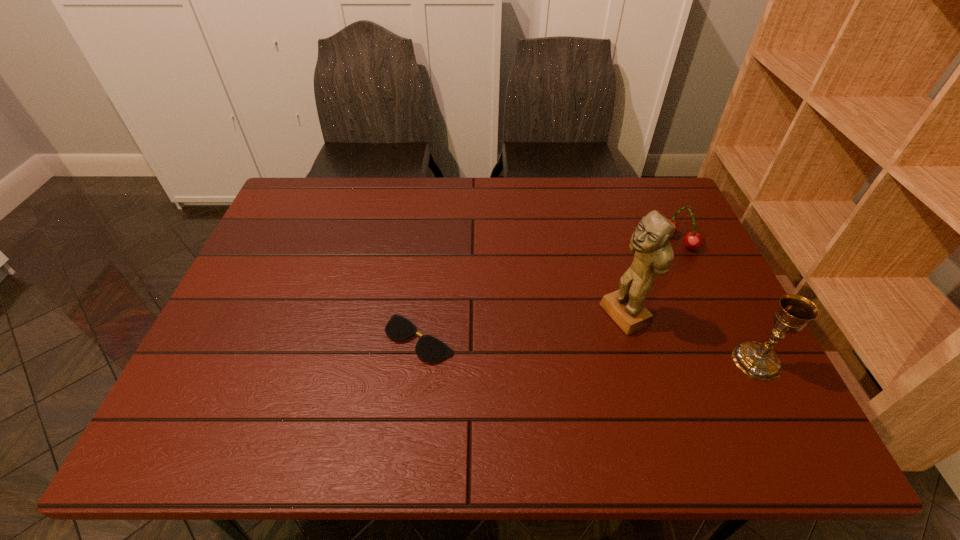
At what (x,y) coordinates should I click in order to perform the action: click on free region located 0.050m on the front-facing side of the figurine. Please return your answer as a coordinate pair (x, y). The image size is (960, 540). Looking at the image, I should click on (590, 333).

The width and height of the screenshot is (960, 540). What are the coordinates of `vacant space situated on the front-facing side of the figurine` in the screenshot? It's located at (459, 395).

Identify the location of vacant space located 0.060m with stems pointing upwards on the cherry. (656, 258).

Where is `vacant area located with stems pointing upwards on the cherry`? The width and height of the screenshot is (960, 540). vacant area located with stems pointing upwards on the cherry is located at coordinates (624, 281).

Find the location of `vacant area situated 0.360m with stems pointing upwards on the cherry`. vacant area situated 0.360m with stems pointing upwards on the cherry is located at coordinates (585, 311).

I want to click on object that is at the near edge, so click(759, 361).

Find the location of `chalice positioned at the right edge`. chalice positioned at the right edge is located at coordinates (759, 361).

The height and width of the screenshot is (540, 960). Find the location of `cherry that is at the right edge`. cherry that is at the right edge is located at coordinates (693, 240).

The image size is (960, 540). Identify the location of object that is at the near right corner. (759, 361).

In the image, there is a desktop. Identify the location of vacant space at the far edge. The height and width of the screenshot is (540, 960). (353, 215).